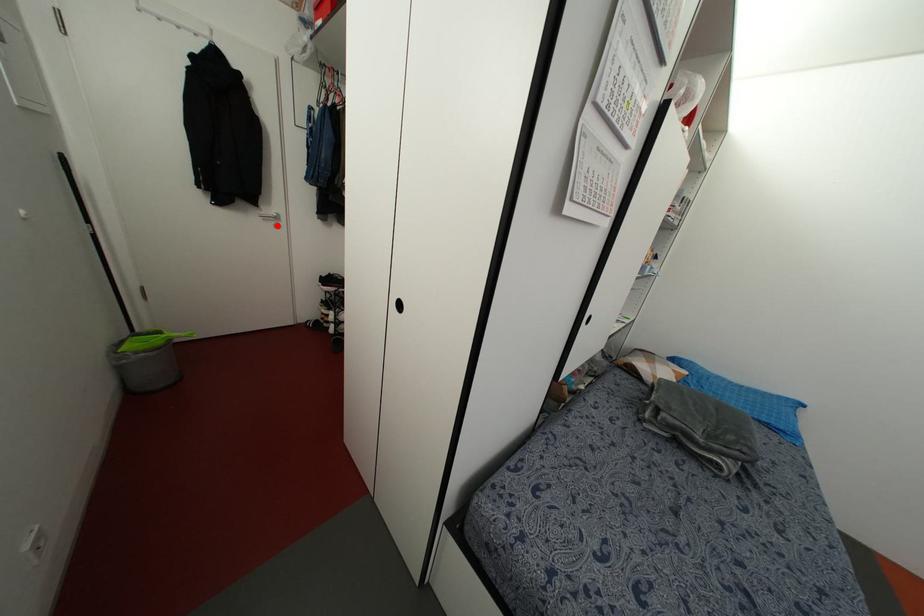
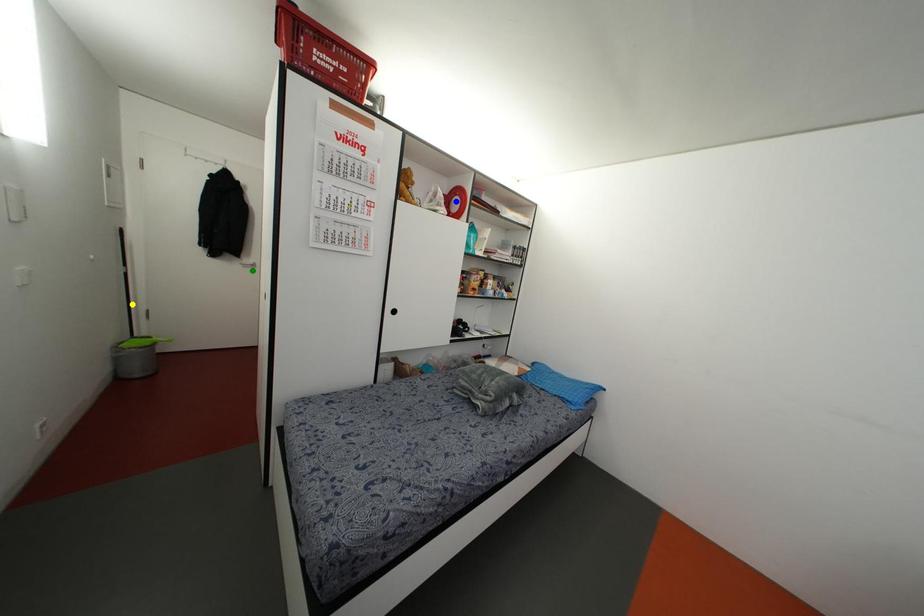
Question: I am providing you with two images of the same scene from different viewpoints. A red point is marked on the first image. You are given multiple points on the second image. Which spot in image 2 lines up with the point in image 1?

Choices:
 (A) blue point
 (B) yellow point
 (C) green point

Answer: (C)